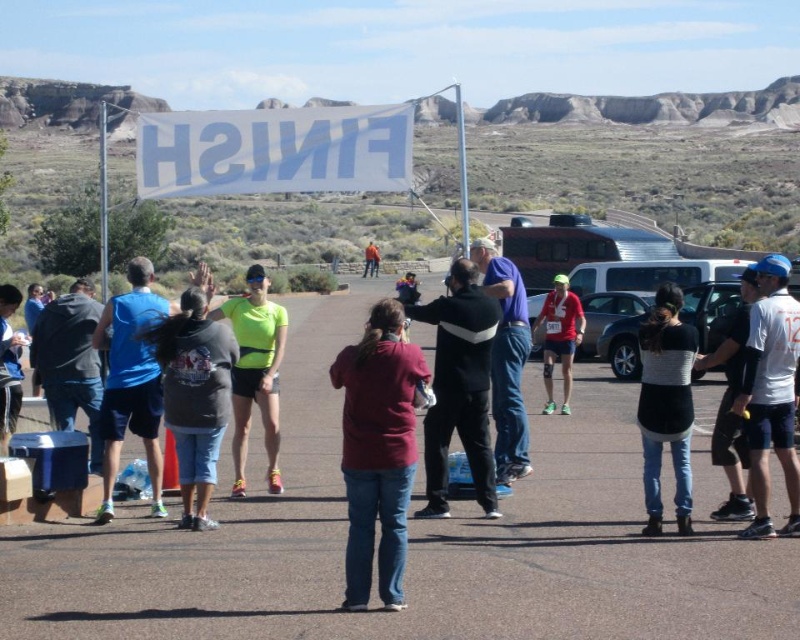
You are a photographer standing at the race finish line. You want to take a photo that includes both the red fabric runner at center and the metallic silver car at center. Which object should you focus on first to ensure both are in frame?

The red fabric runner at center is much taller than the metallic silver car at center. To ensure both are in frame, focus on the taller object first, which is the red fabric runner at center.

Based on the scene description, where is the red fabric runner at center located in the image?

The red fabric runner at center is located at point (560, 337) in the image.

You are a photographer at the race finish line. You want to take a photo of the maroon fabric shirt at center and the black and white striped sweater at center. Which clothing item will appear narrower in the photo?

The maroon fabric shirt at center is thinner than the black and white striped sweater at center, so it will appear narrower in the photo.